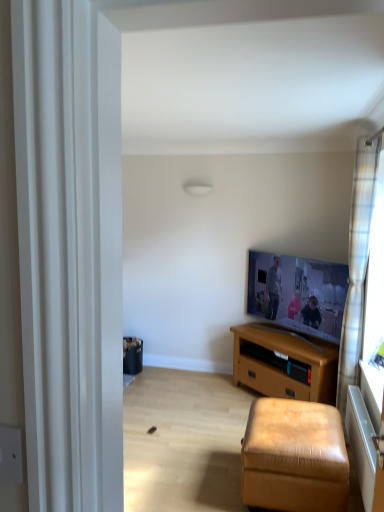
Find the location of a particular element. vacant space situated above leather-like stool at lower right (from a real-world perspective) is located at coordinates click(303, 415).